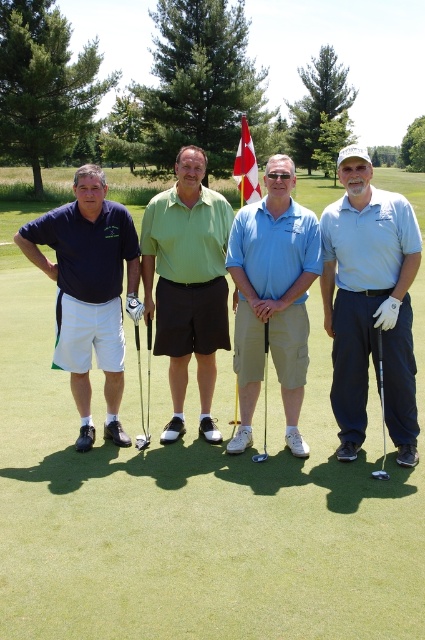
Does matte blue shirt at left lie in front of green matte shirt at center?

Yes, matte blue shirt at left is in front of green matte shirt at center.

You are a GUI agent. You are given a task and a screenshot of the screen. Output one action in this format:
    pyautogui.click(x=<x>, y=<y>)
    Task: Click on the matte blue shirt at left
    The width and height of the screenshot is (425, 640).
    Given the screenshot: What is the action you would take?
    pyautogui.click(x=88, y=291)

Is matte blue shirt at left thinner than metallic silver golf club at center?

No, matte blue shirt at left is not thinner than metallic silver golf club at center.

Which is in front, point (70, 353) or point (136, 444)?

Point (70, 353) is in front.

Locate an element on the screen. The height and width of the screenshot is (640, 425). matte blue shirt at left is located at coordinates point(88,291).

Who is positioned more to the left, red/white fabric flag at center or black rubber golf club at right?

red/white fabric flag at center

Is point (255, 163) in front of point (382, 390)?

No, (255, 163) is behind (382, 390).

Does point (238, 156) come behind point (379, 477)?

Yes.

Locate an element on the screen. red/white fabric flag at center is located at coordinates (246, 166).